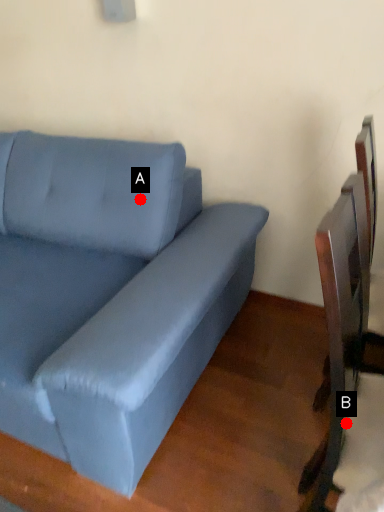
Question: Two points are circled on the image, labeled by A and B beside each circle. Which of the following is the closest to the observer?

Choices:
 (A) A is closer
 (B) B is closer

Answer: (B)